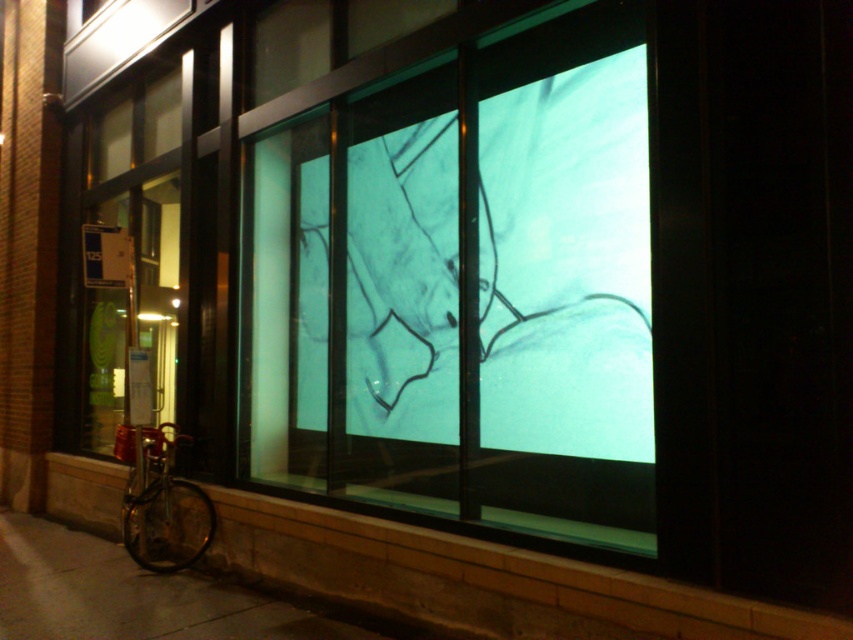
Is transparent glass drawing at center to the left of shiny metallic bicycle at lower left from the viewer's perspective?

No, transparent glass drawing at center is not to the left of shiny metallic bicycle at lower left.

Is transparent glass drawing at center smaller than shiny metallic bicycle at lower left?

Actually, transparent glass drawing at center might be larger than shiny metallic bicycle at lower left.

Describe the element at coordinates (463, 289) in the screenshot. This screenshot has width=853, height=640. I see `transparent glass drawing at center` at that location.

Where is `transparent glass drawing at center`? transparent glass drawing at center is located at coordinates (463, 289).